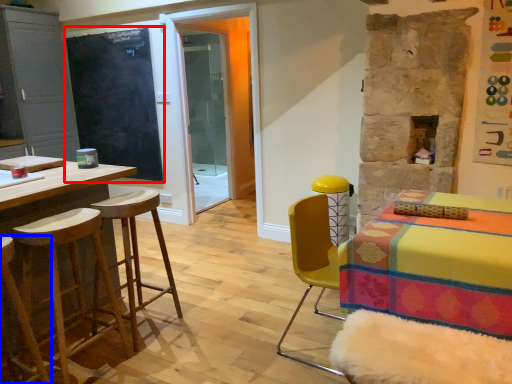
Question: Which object is further to the camera taking this photo, bulletin board (highlighted by a red box) or stool (highlighted by a blue box)?

Choices:
 (A) bulletin board
 (B) stool

Answer: (A)